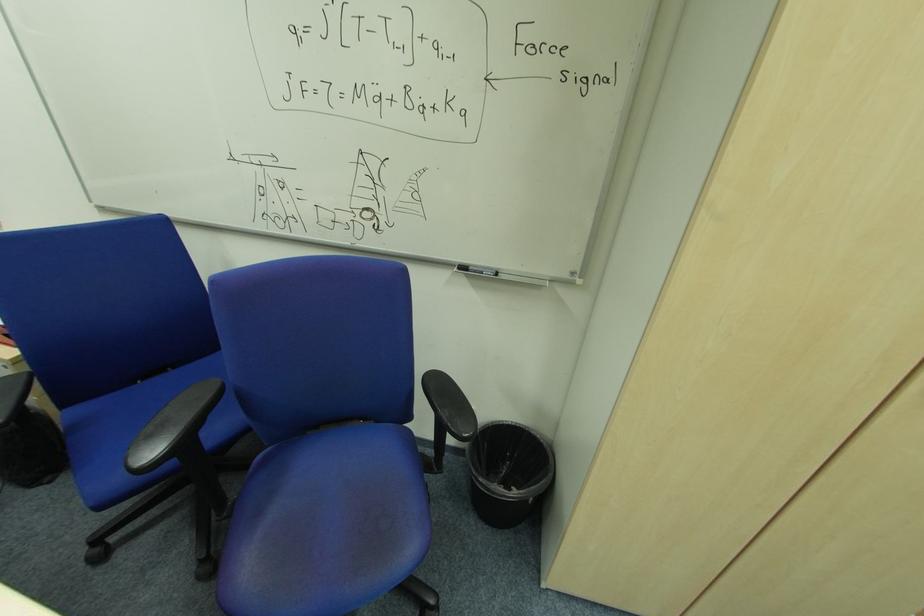
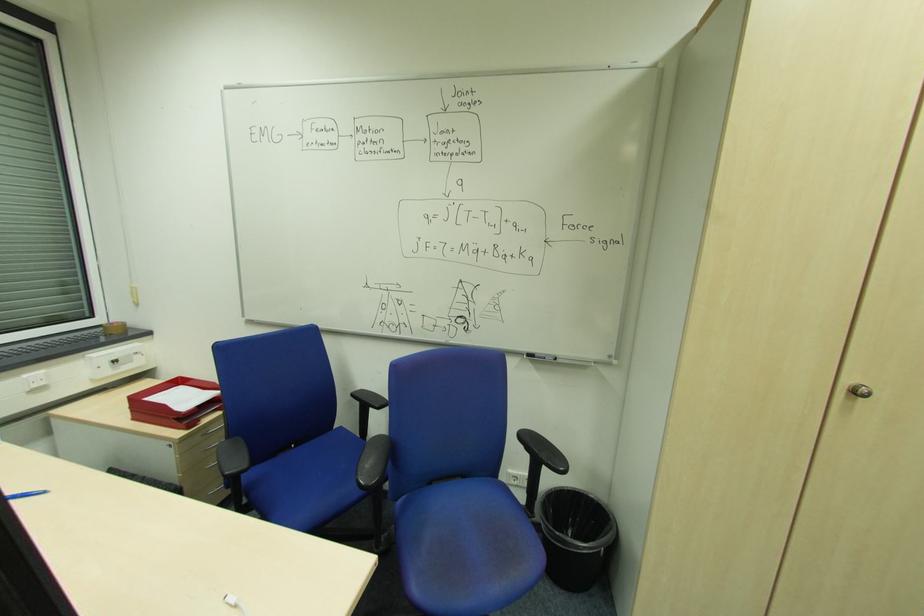
In the second image, find the point that corresponds to pixel 262 456 in the first image.

(402, 501)